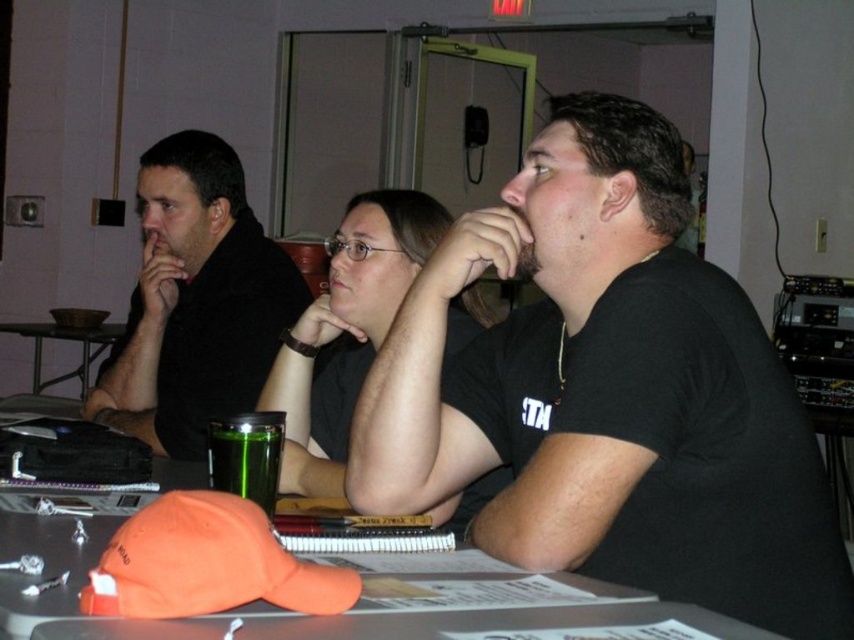
You are standing in front of the table where three people are seated. There are two points marked on the table surface. One is at coordinates point (588, 611) and the other at point (219, 486). Which of these two points is closer to you?

Point (588, 611) is closer to the viewer than point (219, 486).

You are organizing a photo shoot and need to ensure that the matte black shirt at left and the orange fabric cap at center are visible in the frame. Based on their sizes, which object should you focus on to ensure both are in focus?

The matte black shirt at left is larger than the orange fabric cap at center, so focusing on the matte black shirt at left would help ensure both are in focus since it occupies more space in the frame.

You are organizing a meeting and need to place a name tag for the presenter. The orange fabric cap at center and the metallic dark gray table at left are in the scene. Which object is closer to the right edge of the table?

The orange fabric cap at center is positioned on the right side of the metallic dark gray table at left, so it is closer to the right edge of the table.